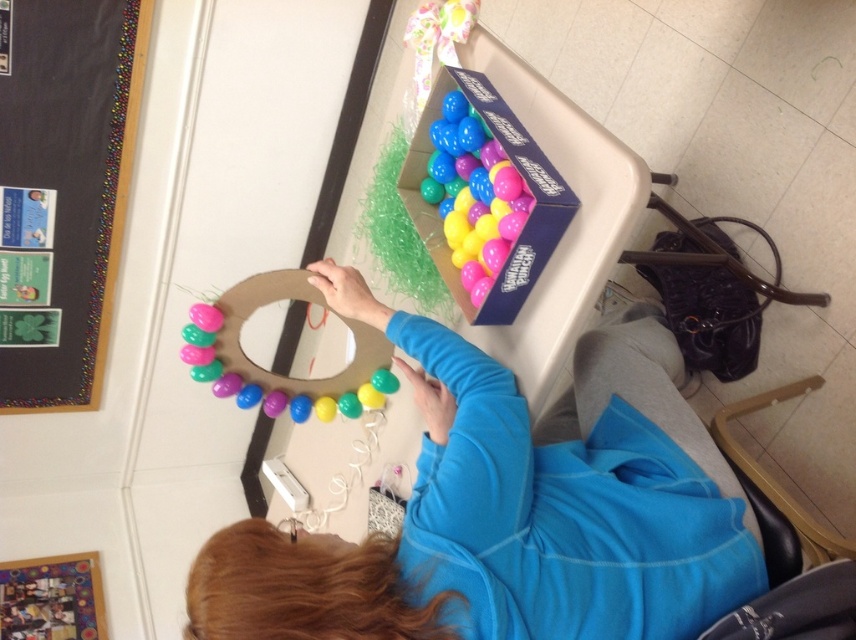
Question: Which point appears closest to the camera in this image?

Choices:
 (A) (522, 212)
 (B) (192, 316)

Answer: (A)

Question: Which point appears farthest from the camera in this image?

Choices:
 (A) (27, 230)
 (B) (203, 556)

Answer: (A)

Question: Can you confirm if black matte bulletin board at upper left is wider than matte pink balloon at upper left?

Choices:
 (A) no
 (B) yes

Answer: (B)

Question: In this image, where is matte plastic egg wreath at center located relative to matte plastic balloons at upper right?

Choices:
 (A) left
 (B) right

Answer: (B)

Question: Which of the following is the farthest from the observer?

Choices:
 (A) (676, 612)
 (B) (207, 324)
 (C) (48, 56)

Answer: (C)

Question: Is matte plastic balloons at upper right in front of matte pink balloon at upper left?

Choices:
 (A) yes
 (B) no

Answer: (A)